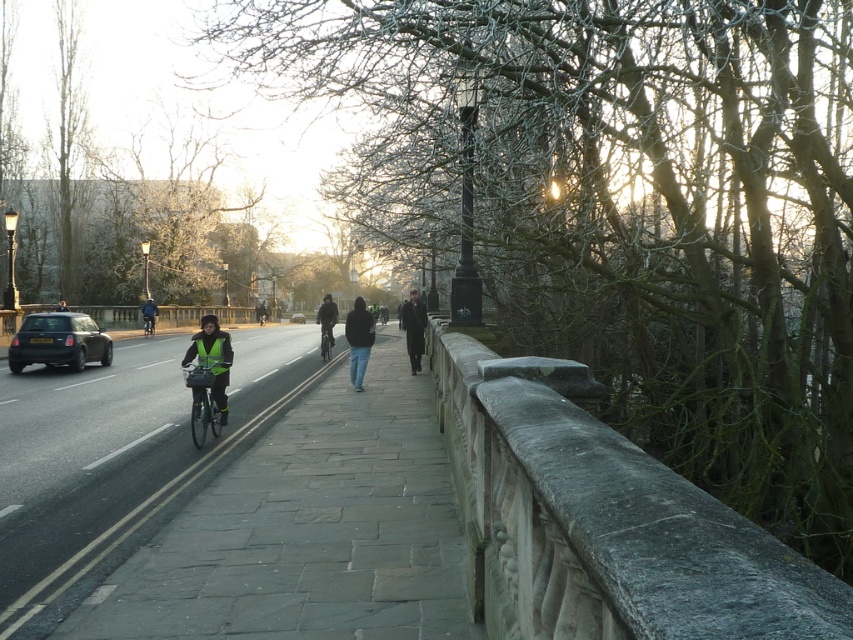
Question: Can you confirm if neon yellow reflective vest at center is positioned to the right of dark gray coat at center?

Choices:
 (A) yes
 (B) no

Answer: (B)

Question: Is metallic silver bike lane at center below shiny blue bicycle at center?

Choices:
 (A) yes
 (B) no

Answer: (A)

Question: Is shiny black car at left above shiny blue bicycle at center?

Choices:
 (A) yes
 (B) no

Answer: (B)

Question: Based on their relative distances, which object is farther from the dark gray jacket at center?

Choices:
 (A) dark gray coat at center
 (B) dark blue jeans at center
 (C) reflective blue jacket at center
 (D) shiny blue bicycle at center

Answer: (C)

Question: Which is nearer to the dark gray jacket at center?

Choices:
 (A) neon yellow reflective vest at center
 (B) matte black car at center
 (C) shiny black car at left
 (D) matte black bicycle at center

Answer: (C)

Question: Estimate the real-world distances between objects in this image. Which object is farther from the matte black car at center?

Choices:
 (A) dark gray coat at center
 (B) matte black bicycle at center
 (C) neon yellow reflective vest at center

Answer: (C)